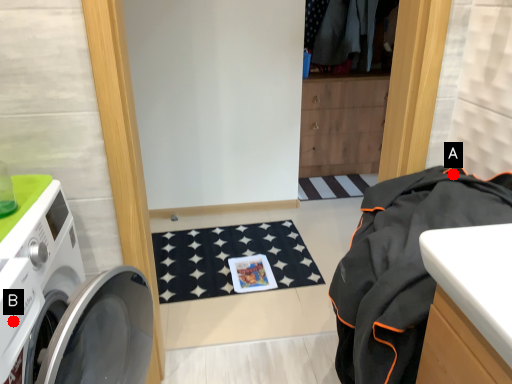
Question: Two points are circled on the image, labeled by A and B beside each circle. Which point is farther to the camera?

Choices:
 (A) A is further
 (B) B is further

Answer: (A)